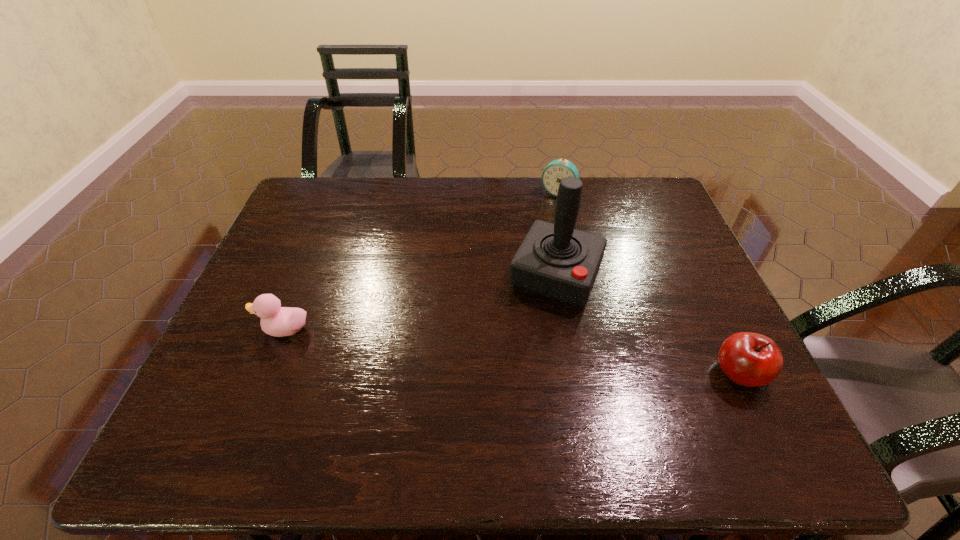
Where is `vacant region located 0.360m on the front-facing side of the farthest object`? This screenshot has height=540, width=960. vacant region located 0.360m on the front-facing side of the farthest object is located at coordinates (512, 272).

The height and width of the screenshot is (540, 960). In order to click on vacant area situated on the base of the third nearest object in this screenshot , I will do `click(532, 328)`.

At what (x,y) coordinates should I click in order to perform the action: click on free point located on the base of the third nearest object. Please return your answer as a coordinate pair (x, y). Looking at the image, I should click on (514, 367).

Where is `vacant space situated 0.240m on the base of the third nearest object`? vacant space situated 0.240m on the base of the third nearest object is located at coordinates (506, 385).

Locate an element on the screen. The width and height of the screenshot is (960, 540). object present at the far edge is located at coordinates (556, 170).

Identify the location of object that is at the near edge. The width and height of the screenshot is (960, 540). (750, 359).

The height and width of the screenshot is (540, 960). What are the coordinates of `object that is at the left edge` in the screenshot? It's located at (277, 321).

Identify the location of object at the right edge. The image size is (960, 540). (750, 359).

Identify the location of object located at the near right corner. (750, 359).

The height and width of the screenshot is (540, 960). In the image, there is a desktop. Identify the location of free space at the far edge. (409, 202).